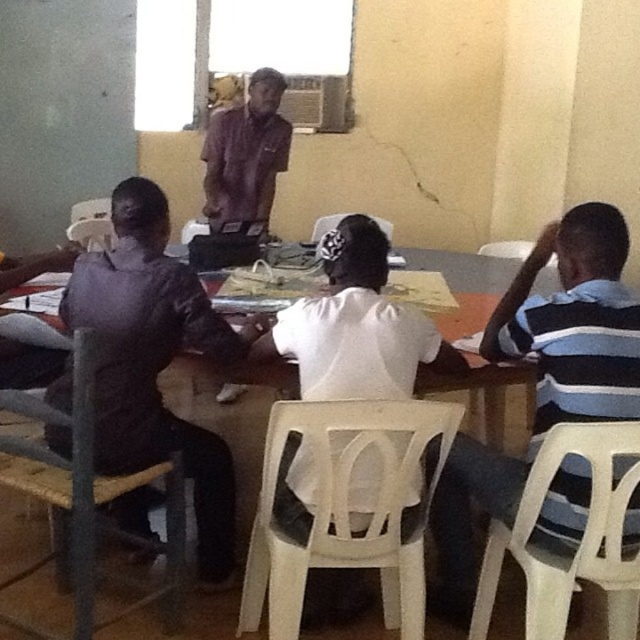
Question: Does blue striped shirt at right appear on the right side of brown fabric shirt at center?

Choices:
 (A) yes
 (B) no

Answer: (A)

Question: Observing the image, what is the correct spatial positioning of blue striped shirt at right in reference to matte black shirt at left?

Choices:
 (A) above
 (B) below

Answer: (B)

Question: Based on their relative distances, which object is farther from the matte black shirt at left?

Choices:
 (A) blue striped shirt at right
 (B) brown fabric shirt at center

Answer: (B)

Question: Observing the image, what is the correct spatial positioning of matte black shirt at left in reference to brown fabric shirt at center?

Choices:
 (A) right
 (B) left

Answer: (B)

Question: Which point is closer to the camera?

Choices:
 (A) (604, 221)
 (B) (120, 353)
 (C) (266, 179)

Answer: (A)

Question: Considering the real-world distances, which object is farthest from the matte black shirt at left?

Choices:
 (A) blue striped shirt at right
 (B) brown fabric shirt at center

Answer: (B)